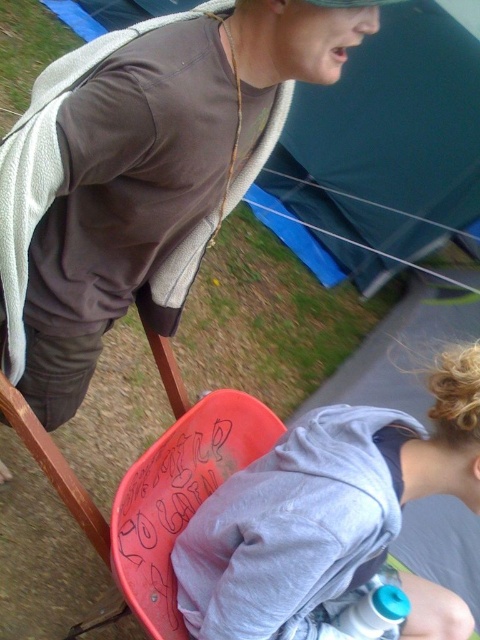
Does matte brown hoodie at upper left have a larger size compared to gray cotton hoodie at lower right?

Yes, matte brown hoodie at upper left is bigger than gray cotton hoodie at lower right.

Between matte brown hoodie at upper left and gray cotton hoodie at lower right, which one has more height?

matte brown hoodie at upper left is taller.

Identify the location of matte brown hoodie at upper left. The image size is (480, 640). (143, 172).

I want to click on matte brown hoodie at upper left, so (x=143, y=172).

Find the location of a particular element. matte brown hoodie at upper left is located at coordinates (143, 172).

Is matte brown hoodie at upper left to the left of blue translucent bottle at lower center from the viewer's perspective?

Correct, you'll find matte brown hoodie at upper left to the left of blue translucent bottle at lower center.

Between point (135, 61) and point (337, 612), which one is positioned in front?

Point (135, 61) is more forward.

Where is `matte brown hoodie at upper left`? matte brown hoodie at upper left is located at coordinates (143, 172).

Can you confirm if gray cotton hoodie at lower right is thinner than blue translucent bottle at lower center?

Incorrect, gray cotton hoodie at lower right's width is not less than blue translucent bottle at lower center's.

Can you confirm if gray cotton hoodie at lower right is positioned to the right of blue translucent bottle at lower center?

No, gray cotton hoodie at lower right is not to the right of blue translucent bottle at lower center.

Who is more forward, (x=415, y=424) or (x=373, y=600)?

Point (x=415, y=424) is more forward.

The width and height of the screenshot is (480, 640). I want to click on gray cotton hoodie at lower right, so click(x=324, y=508).